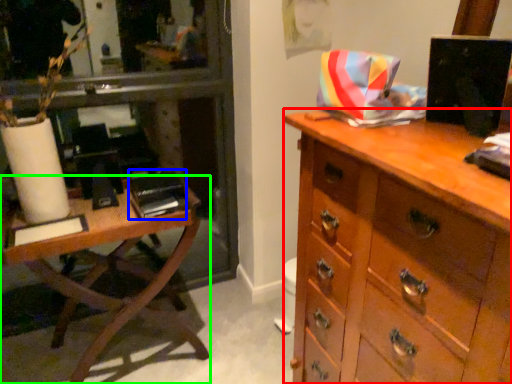
Question: Which is farther away from chest of drawers (highlighted by a red box)? book (highlighted by a blue box) or table (highlighted by a green box)?

Choices:
 (A) book
 (B) table

Answer: (B)